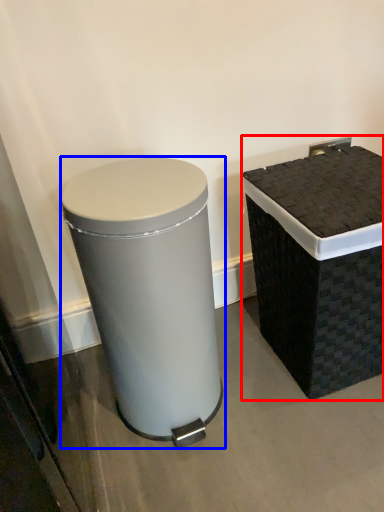
Question: Among these objects, which one is farthest to the camera, waste container (highlighted by a red box) or waste container (highlighted by a blue box)?

Choices:
 (A) waste container
 (B) waste container

Answer: (A)